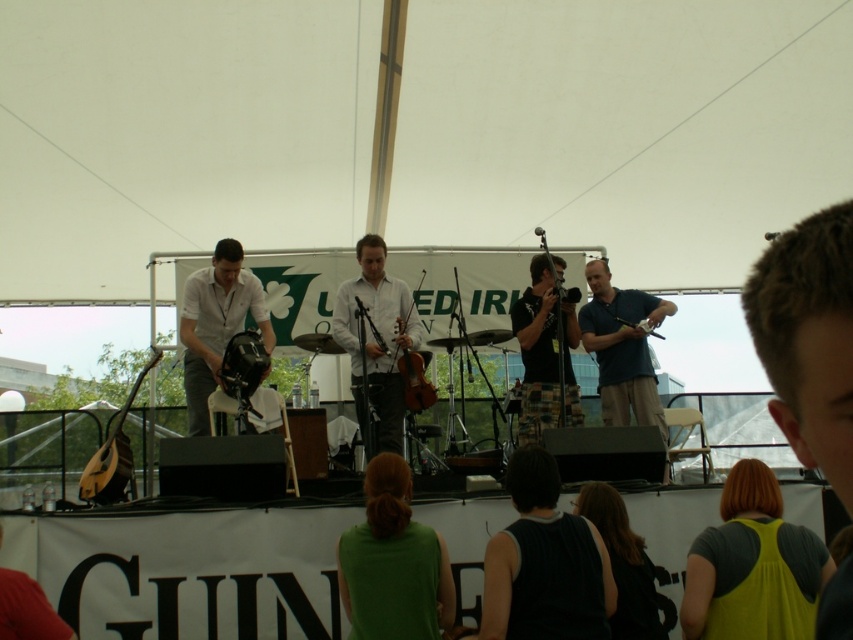
You are a photographer at the back of the tent and want to take a photo that includes both the blue cotton shirt at center and the brown wooden violin at center. Which object should you focus on first to ensure both are in frame?

You should focus on the blue cotton shirt at center first because it is larger in size than the brown wooden violin at center, so it will be easier to frame both objects by starting with the larger one.

In the scene shown: You are a photographer positioned at the back of the tent, aiming to capture a clear shot of both the green fabric shirt at center and the matte black helmet at center. Based on their heights, which object should you focus on first to ensure both are in frame?

The green fabric shirt at center has a lesser height compared to the matte black helmet at center, so you should focus on the matte black helmet at center first to ensure both are in frame.

You are a photographer standing at the back of the tent, aiming to capture a group photo of the musicians. You have a camera with a 1.8 meter wide lens. Will the blue cotton shirt at center and the brown wooden violin at center fit within the camera lens width?

The blue cotton shirt at center and the brown wooden violin at center are 1.93 meters apart. Since the distance between them exceeds the camera lens width of 1.8 meters, they will not fit within the lens width.